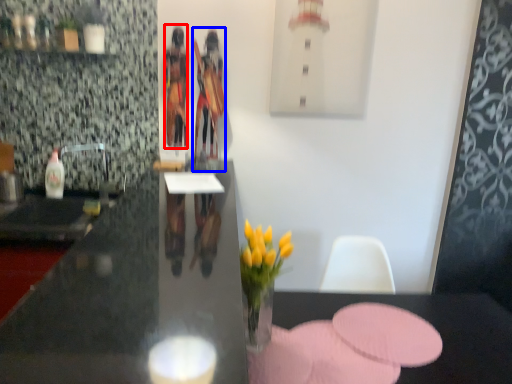
Question: Which object appears closest to the camera in this image, person (highlighted by a red box) or person (highlighted by a blue box)?

Choices:
 (A) person
 (B) person

Answer: (B)